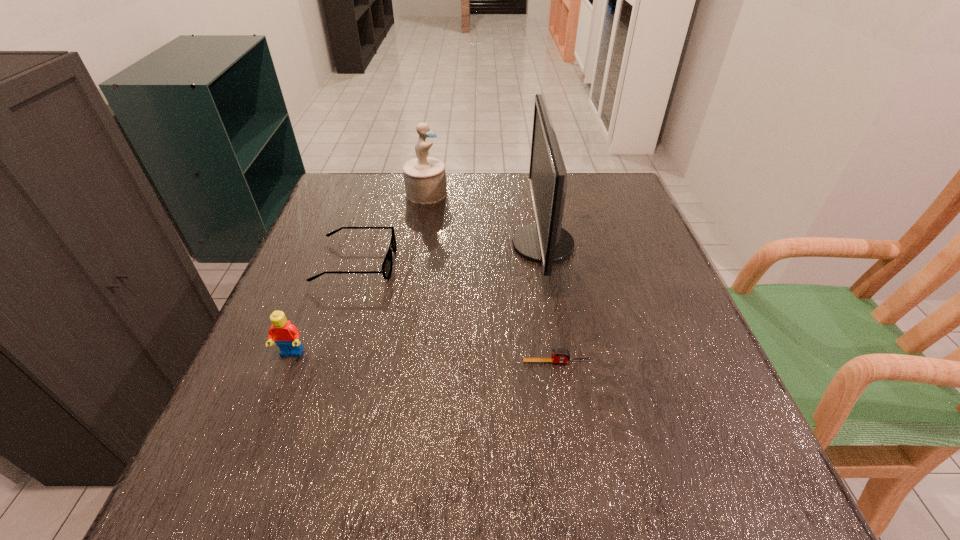
Where is `free space at the far left corner of the desktop`? free space at the far left corner of the desktop is located at coordinates (384, 175).

This screenshot has height=540, width=960. Identify the location of vacant region at the far right corner. (601, 214).

Identify the location of free spot between the second tallest object and the tape measure. (492, 278).

Identify the location of vacant space in between the monitor and the third shortest object. (418, 299).

The height and width of the screenshot is (540, 960). Identify the location of vacant area between the spectacles and the shortest object. (457, 312).

Identify the location of vacant space in between the Lego and the shortest object. This screenshot has width=960, height=540. (424, 357).

The image size is (960, 540). Find the location of `unoccupied area between the fourth tallest object and the tape measure`. unoccupied area between the fourth tallest object and the tape measure is located at coordinates (457, 312).

You are a GUI agent. You are given a task and a screenshot of the screen. Output one action in this format:
    pyautogui.click(x=<x>, y=<y>)
    Task: Click on the empty space that is in between the tape measure and the monitor
    This screenshot has height=540, width=960.
    Given the screenshot: What is the action you would take?
    pyautogui.click(x=550, y=303)

The width and height of the screenshot is (960, 540). I want to click on empty space that is in between the third shortest object and the shortest object, so click(x=424, y=357).

Locate which object is the closest to the fourth tallest object. Please provide its 2D coordinates. Your answer should be formatted as a tuple, i.e. [(x, y)], where the tuple contains the x and y coordinates of a point satisfying the conditions above.

[(425, 178)]